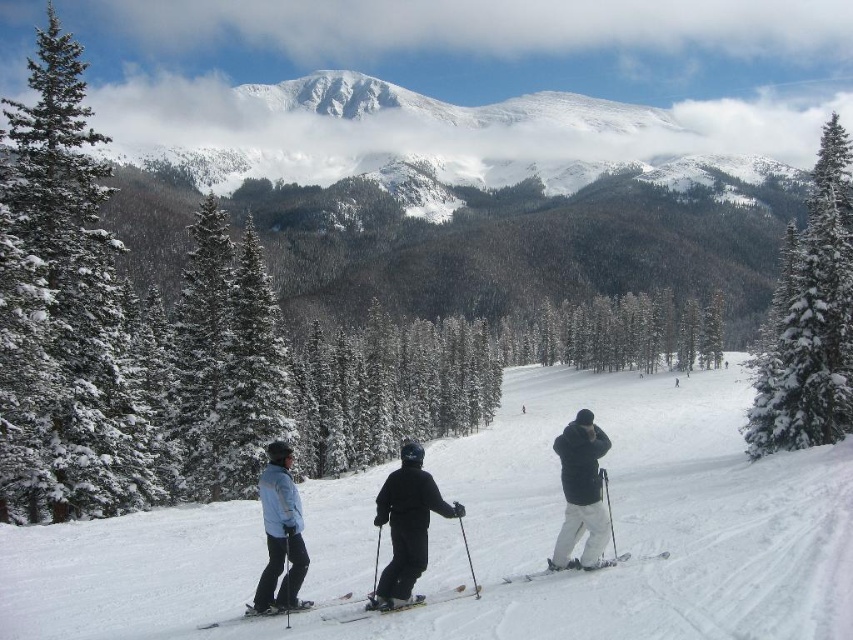
You are standing at point (463, 586) and want to reach the ski lift located at the opposite side of the slope. The slope has a 15 degree incline. If your maximum comfortable walking angle is 12 degrees, can you walk directly to the ski lift without using skis?

The slope has a 15 degree incline, which exceeds your maximum comfortable walking angle of 12 degrees. Therefore, you cannot walk directly to the ski lift without using skis.

From the picture: You are a photographer positioned at the origin point of the image. You want to capture a photo of the black matte ski suit at center. What are the coordinates of the object you need to focus on?

The coordinates of the black matte ski suit at center are at point [405,525].